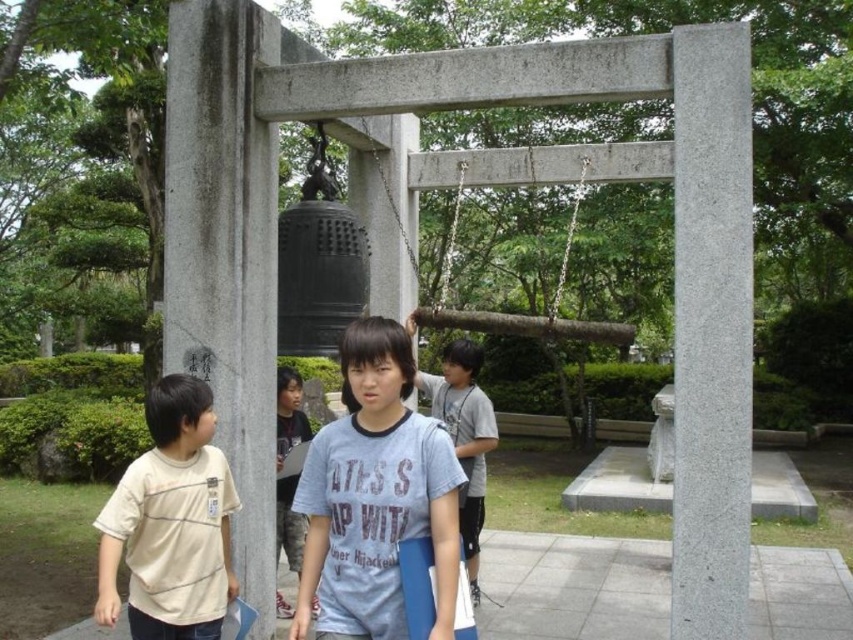
Question: Does gray stone pillar at left come behind beige cotton t-shirt at left?

Choices:
 (A) yes
 (B) no

Answer: (A)

Question: Does gray stone pillar at left appear under light blue cotton shirt at center?

Choices:
 (A) yes
 (B) no

Answer: (B)

Question: Does blue cotton shirt at center appear under beige cotton t-shirt at left?

Choices:
 (A) yes
 (B) no

Answer: (B)

Question: Among these objects, which one is nearest to the camera?

Choices:
 (A) gray granite pillar at center
 (B) beige cotton t-shirt at left
 (C) blue cotton shirt at center

Answer: (C)

Question: Among these objects, which one is nearest to the camera?

Choices:
 (A) beige cotton t-shirt at left
 (B) gray stone pillar at left
 (C) blue cotton shirt at center
 (D) gray granite pillar at center

Answer: (C)

Question: Considering the real-world distances, which object is closest to the gray stone pillar at left?

Choices:
 (A) beige cotton t-shirt at left
 (B) blue cotton shirt at center
 (C) light blue t-shirt at center
 (D) gray granite pillar at center

Answer: (A)